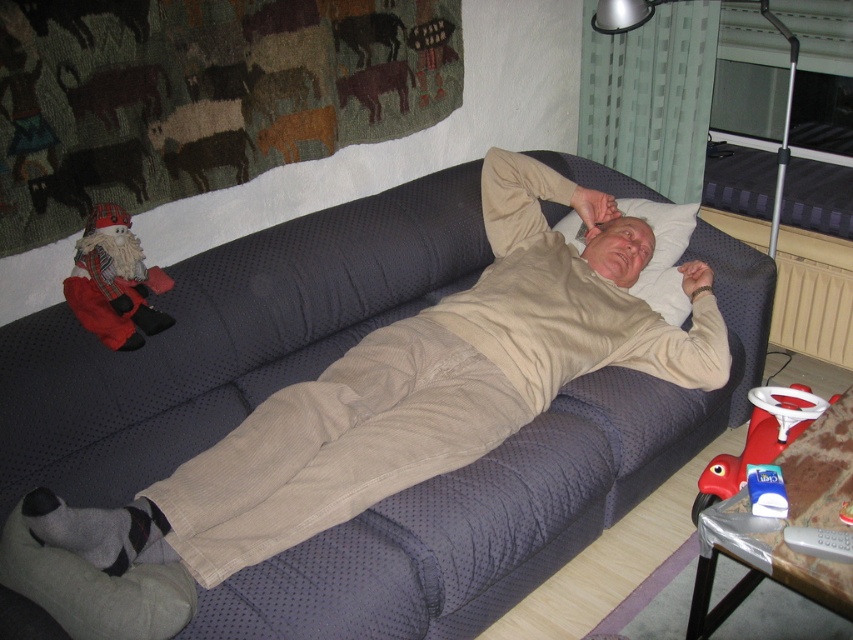
Question: Which of the following is the farthest from the observer?

Choices:
 (A) (631, 209)
 (B) (763, 314)
 (C) (131, 269)

Answer: (A)

Question: Can you confirm if dark blue textured couch at center is smaller than white soft pillow at upper center?

Choices:
 (A) no
 (B) yes

Answer: (A)

Question: Is dark blue textured couch at center to the right of red plaid santa at left from the viewer's perspective?

Choices:
 (A) no
 (B) yes

Answer: (B)

Question: Among these points, which one is farthest from the camera?

Choices:
 (A) (375, 260)
 (B) (648, 221)

Answer: (B)

Question: Does red plaid santa at left appear under white soft pillow at upper center?

Choices:
 (A) yes
 (B) no

Answer: (A)

Question: Based on their relative distances, which object is nearer to the white soft pillow at upper center?

Choices:
 (A) red plaid santa at left
 (B) dark blue textured couch at center

Answer: (B)